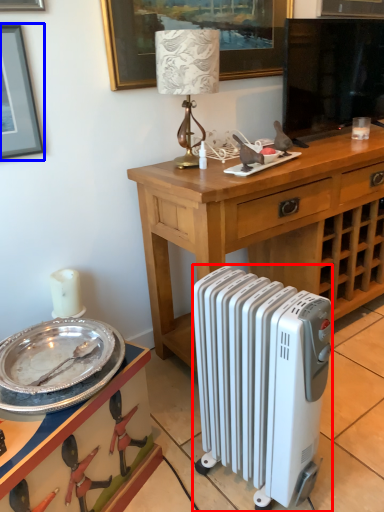
Question: Which object appears farthest to the camera in this image, radiator (highlighted by a red box) or picture frame (highlighted by a blue box)?

Choices:
 (A) radiator
 (B) picture frame

Answer: (B)